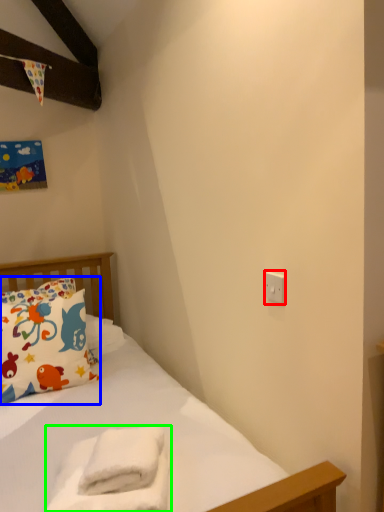
Question: Which object is positioned farthest from electric outlet (highlighted by a red box)? Select from pillow (highlighted by a blue box) and material (highlighted by a green box).

Choices:
 (A) pillow
 (B) material

Answer: (A)